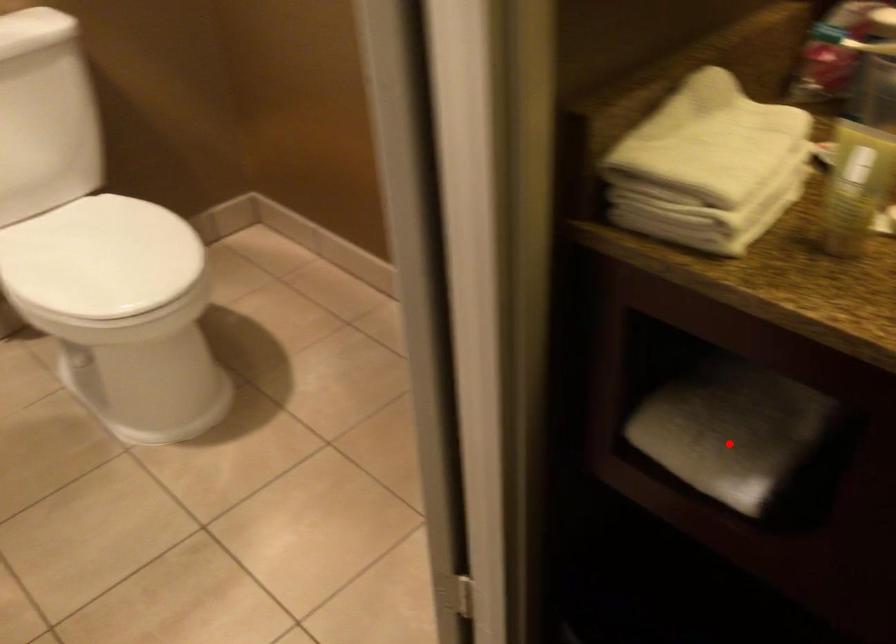
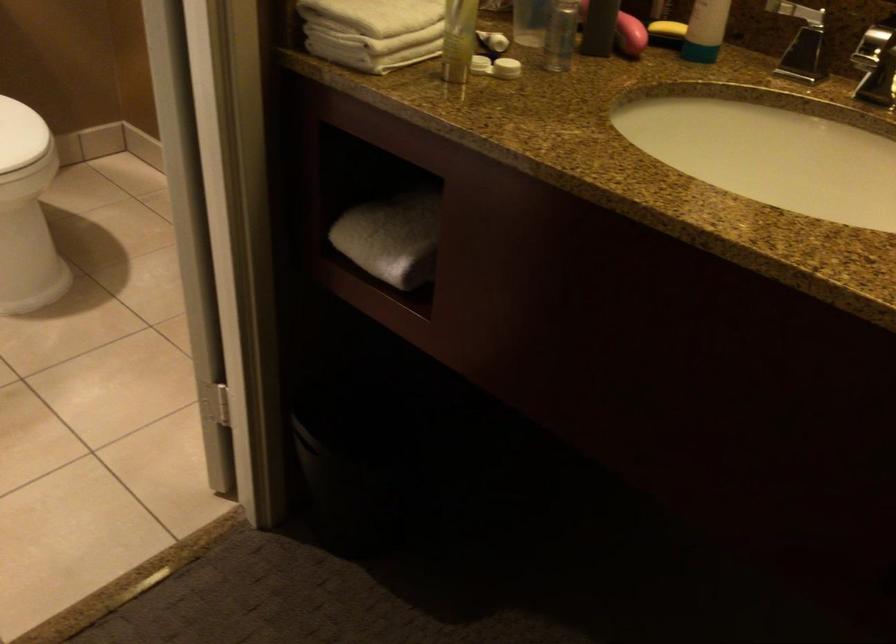
Question: I am providing you with two images of the same scene from different viewpoints. A red point is shown in image1. For the corresponding object point in image2, is it positioned nearer or farther from the camera?

Choices:
 (A) Nearer
 (B) Farther

Answer: (B)